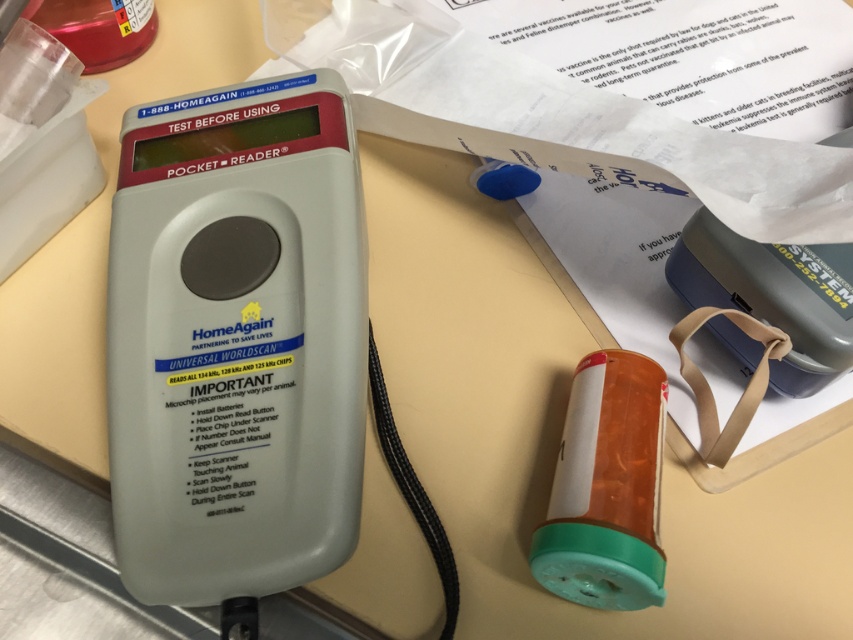
Question: Where is white plastic pocket reader at center located in relation to translucent plastic pill bottle at center in the image?

Choices:
 (A) left
 (B) right

Answer: (A)

Question: Is white plastic pocket reader at center positioned behind translucent plastic pill bottle at center?

Choices:
 (A) no
 (B) yes

Answer: (B)

Question: Estimate the real-world distances between objects in this image. Which object is closer to the translucent plastic pill bottle at center?

Choices:
 (A) translucent plastic bottle at upper left
 (B) white plastic pocket reader at center

Answer: (B)

Question: Which point is farther to the camera?

Choices:
 (A) white plastic pocket reader at center
 (B) translucent plastic pill bottle at center
 (C) translucent plastic bottle at upper left

Answer: (C)

Question: Estimate the real-world distances between objects in this image. Which object is closer to the translucent plastic pill bottle at center?

Choices:
 (A) translucent plastic bottle at upper left
 (B) white plastic pocket reader at center

Answer: (B)

Question: Does white plastic pocket reader at center appear under translucent plastic bottle at upper left?

Choices:
 (A) yes
 (B) no

Answer: (A)